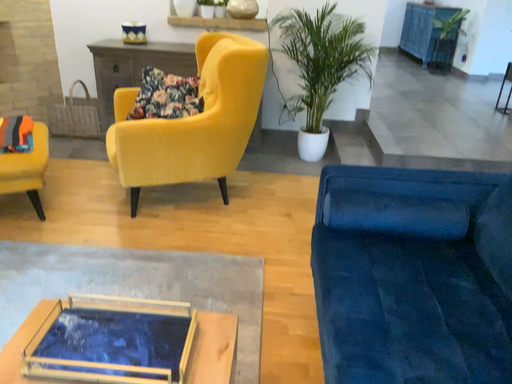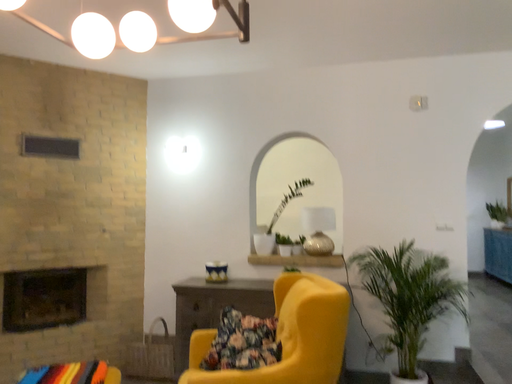
Question: How did the camera likely rotate when shooting the video?

Choices:
 (A) rotated left
 (B) rotated right

Answer: (A)